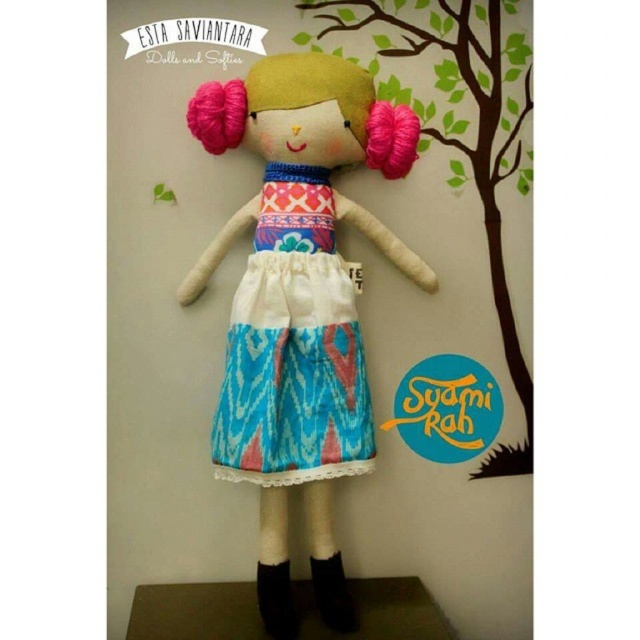
Is point (314, 385) positioned behind point (282, 310)?

Yes, it is.

This screenshot has height=640, width=640. I want to click on textured fabric doll at center, so click(x=298, y=304).

I want to click on textured fabric doll at center, so click(298, 304).